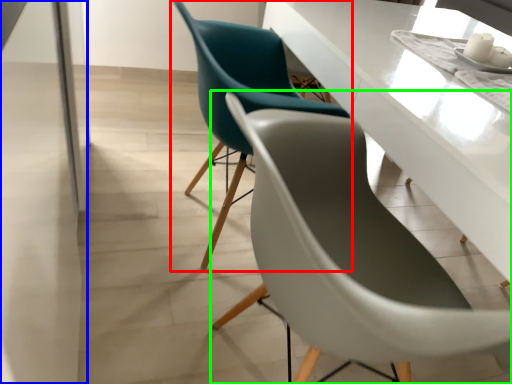
Question: Which is farther away from chair (highlighted by a red box)? glass door (highlighted by a blue box) or chair (highlighted by a green box)?

Choices:
 (A) glass door
 (B) chair

Answer: (A)